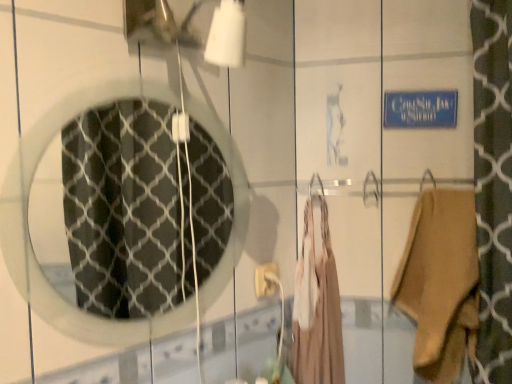
Question: From the image's perspective, is white plastic electric outlet at center under tan suede boot at right, the 1th clothing viewed from the right?

Choices:
 (A) yes
 (B) no

Answer: (B)

Question: Considering the relative positions of white plastic electric outlet at center and tan suede boot at right, the second clothing viewed from the left, in the image provided, is white plastic electric outlet at center to the right of tan suede boot at right, the second clothing viewed from the left, from the viewer's perspective?

Choices:
 (A) no
 (B) yes

Answer: (A)

Question: Is white plastic electric outlet at center positioned far away from tan suede boot at right, the second clothing viewed from the left?

Choices:
 (A) no
 (B) yes

Answer: (A)

Question: Is white plastic electric outlet at center taller than tan suede boot at right, the 1th clothing viewed from the right?

Choices:
 (A) no
 (B) yes

Answer: (A)

Question: Does white plastic electric outlet at center have a smaller size compared to tan suede boot at right, the 1th clothing viewed from the right?

Choices:
 (A) no
 (B) yes

Answer: (B)

Question: Is clear glass mirror at center inside the boundaries of white plastic electric outlet at center, or outside?

Choices:
 (A) inside
 (B) outside

Answer: (B)

Question: Considering their positions, is clear glass mirror at center located in front of or behind white plastic electric outlet at center?

Choices:
 (A) behind
 (B) front

Answer: (B)

Question: From the image's perspective, is clear glass mirror at center positioned above or below white plastic electric outlet at center?

Choices:
 (A) below
 (B) above

Answer: (B)

Question: Considering the relative positions of clear glass mirror at center and white plastic electric outlet at center in the image provided, is clear glass mirror at center to the left or to the right of white plastic electric outlet at center?

Choices:
 (A) left
 (B) right

Answer: (A)

Question: Would you say beige fabric dress at center, which is the 2th clothing from right to left, is to the left or to the right of white plastic electric outlet at center in the picture?

Choices:
 (A) right
 (B) left

Answer: (A)

Question: From the image's perspective, is beige fabric dress at center, the 1th clothing when ordered from left to right, positioned above or below white plastic electric outlet at center?

Choices:
 (A) below
 (B) above

Answer: (A)

Question: Considering the positions of beige fabric dress at center, which is the 2th clothing from right to left, and white plastic electric outlet at center in the image, is beige fabric dress at center, which is the 2th clothing from right to left, taller or shorter than white plastic electric outlet at center?

Choices:
 (A) tall
 (B) short

Answer: (A)

Question: From a real-world perspective, is beige fabric dress at center, which is the 2th clothing from right to left, physically located above or below white plastic electric outlet at center?

Choices:
 (A) above
 (B) below

Answer: (B)

Question: Is white plastic electric outlet at center wider or thinner than clear glass mirror at center?

Choices:
 (A) wide
 (B) thin

Answer: (A)

Question: Is white plastic electric outlet at center inside the boundaries of clear glass mirror at center, or outside?

Choices:
 (A) inside
 (B) outside

Answer: (B)